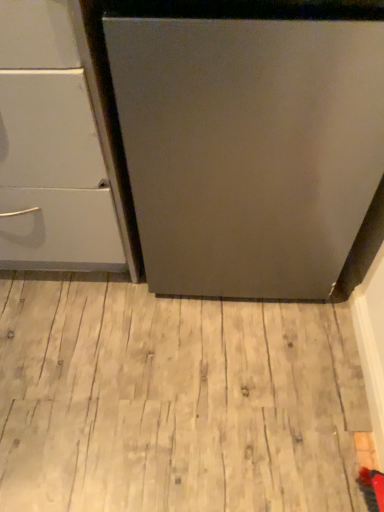
Question: Is the depth of light wood flooring at center less than that of white glossy drawer at left?

Choices:
 (A) yes
 (B) no

Answer: (B)

Question: Is light wood flooring at center completely or partially outside of white glossy drawer at left?

Choices:
 (A) no
 (B) yes

Answer: (B)

Question: Does light wood flooring at center have a greater width compared to white glossy drawer at left?

Choices:
 (A) yes
 (B) no

Answer: (A)

Question: From a real-world perspective, is light wood flooring at center below white glossy drawer at left?

Choices:
 (A) yes
 (B) no

Answer: (A)

Question: Does light wood flooring at center have a smaller size compared to white glossy drawer at left?

Choices:
 (A) no
 (B) yes

Answer: (B)

Question: Can you confirm if light wood flooring at center is thinner than white glossy drawer at left?

Choices:
 (A) yes
 (B) no

Answer: (B)

Question: Is white glossy drawer at left not inside light wood flooring at center?

Choices:
 (A) no
 (B) yes

Answer: (B)

Question: Considering the relative sizes of white glossy drawer at left and light wood flooring at center in the image provided, is white glossy drawer at left wider than light wood flooring at center?

Choices:
 (A) no
 (B) yes

Answer: (A)

Question: From a real-world perspective, is white glossy drawer at left over light wood flooring at center?

Choices:
 (A) no
 (B) yes

Answer: (B)

Question: Can you confirm if white glossy drawer at left is taller than light wood flooring at center?

Choices:
 (A) yes
 (B) no

Answer: (A)

Question: Considering the relative sizes of white glossy drawer at left and light wood flooring at center in the image provided, is white glossy drawer at left thinner than light wood flooring at center?

Choices:
 (A) no
 (B) yes

Answer: (B)

Question: Does white glossy drawer at left have a larger size compared to light wood flooring at center?

Choices:
 (A) no
 (B) yes

Answer: (B)

Question: Is light wood flooring at center taller or shorter than white glossy drawer at left?

Choices:
 (A) short
 (B) tall

Answer: (A)